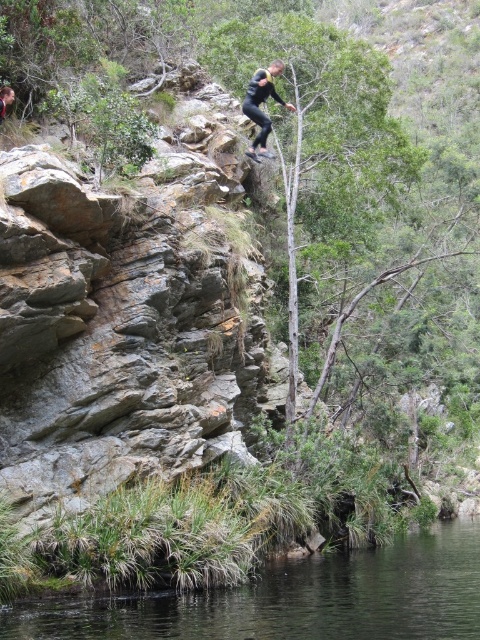
Question: Which of the following is the farthest from the observer?

Choices:
 (A) (420, 545)
 (B) (2, 116)
 (C) (267, 154)

Answer: (A)

Question: Can you confirm if clear water at lower center is positioned to the right of black matte clothing at upper center?

Choices:
 (A) yes
 (B) no

Answer: (A)

Question: Is clear water at lower center bigger than black matte clothing at center?

Choices:
 (A) no
 (B) yes

Answer: (B)

Question: Which point is closer to the camera?

Choices:
 (A) clear water at lower center
 (B) black matte clothing at center
 (C) black matte clothing at upper center

Answer: (A)

Question: Can you confirm if black matte clothing at center is smaller than black matte clothing at upper center?

Choices:
 (A) no
 (B) yes

Answer: (A)

Question: Considering the real-world distances, which object is closest to the black matte clothing at upper center?

Choices:
 (A) clear water at lower center
 (B) black matte clothing at center

Answer: (B)